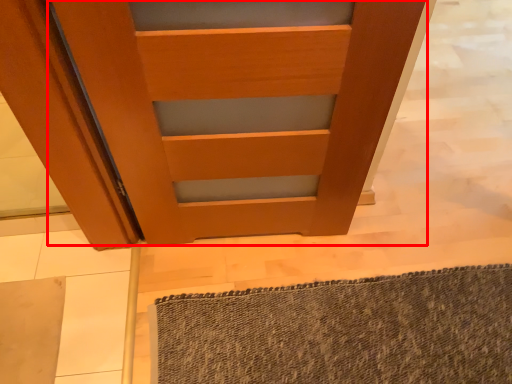
Question: Considering the relative positions of door (annotated by the red box) and bath mat in the image provided, where is door (annotated by the red box) located with respect to the staircase?

Choices:
 (A) left
 (B) right

Answer: (A)